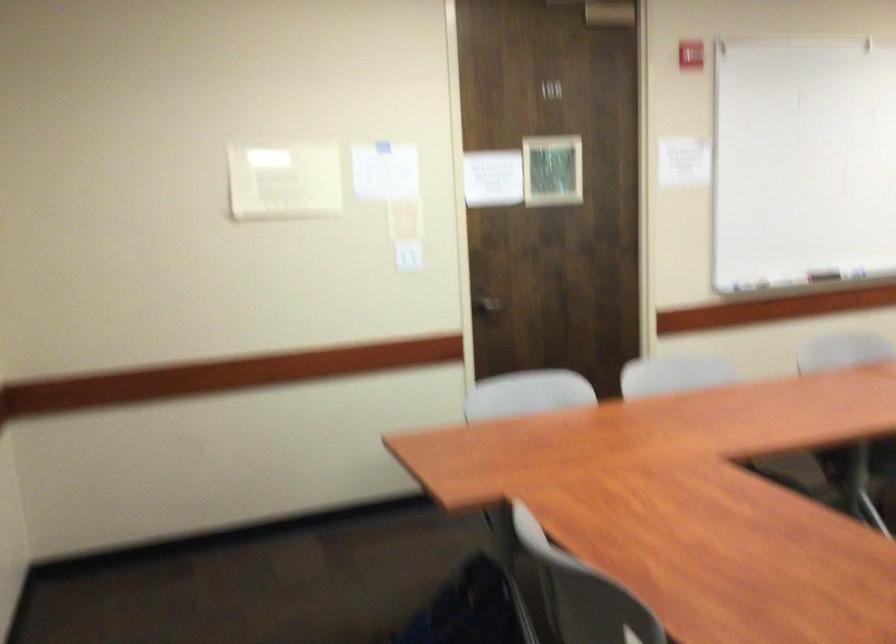
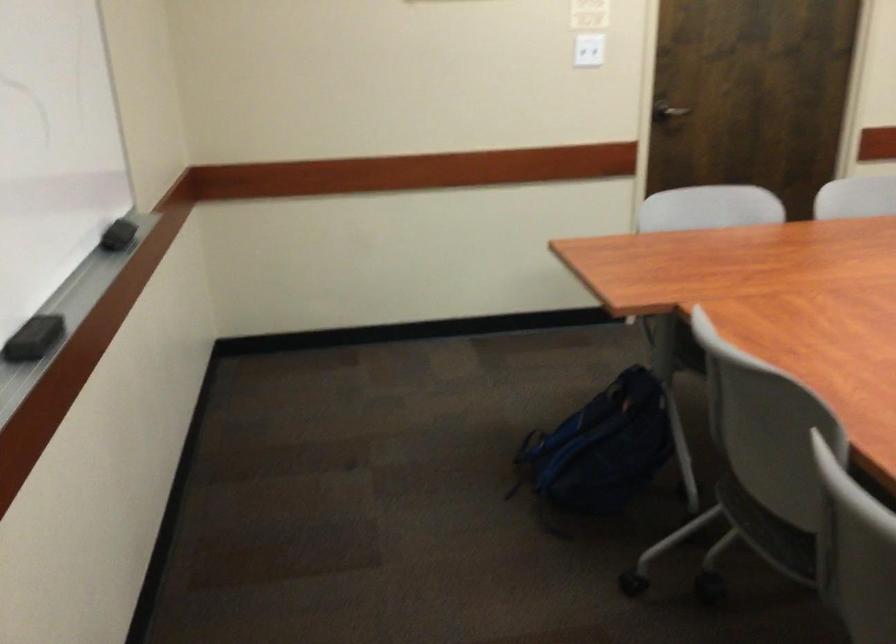
Where in the second image is the point corresponding to the point at 407,254 from the first image?

(588, 51)